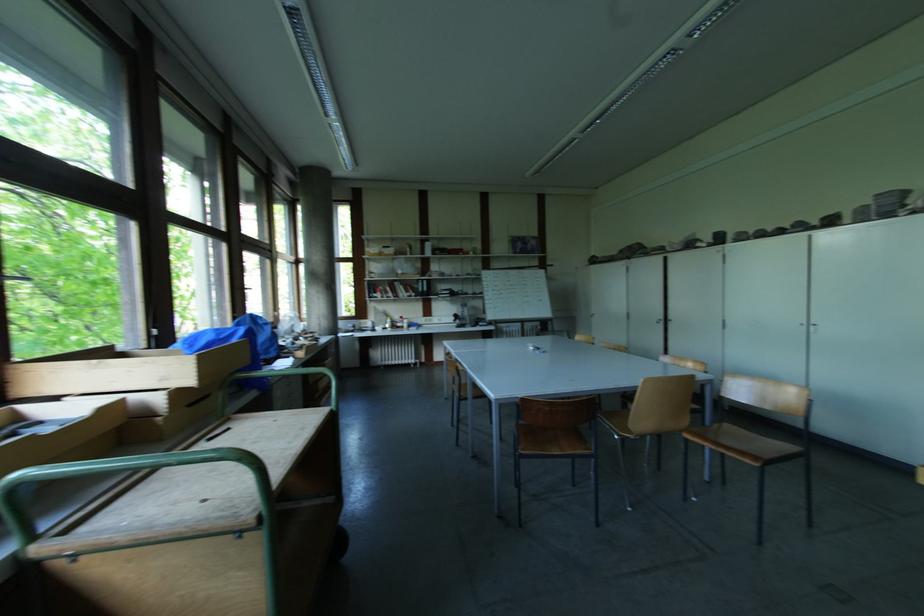
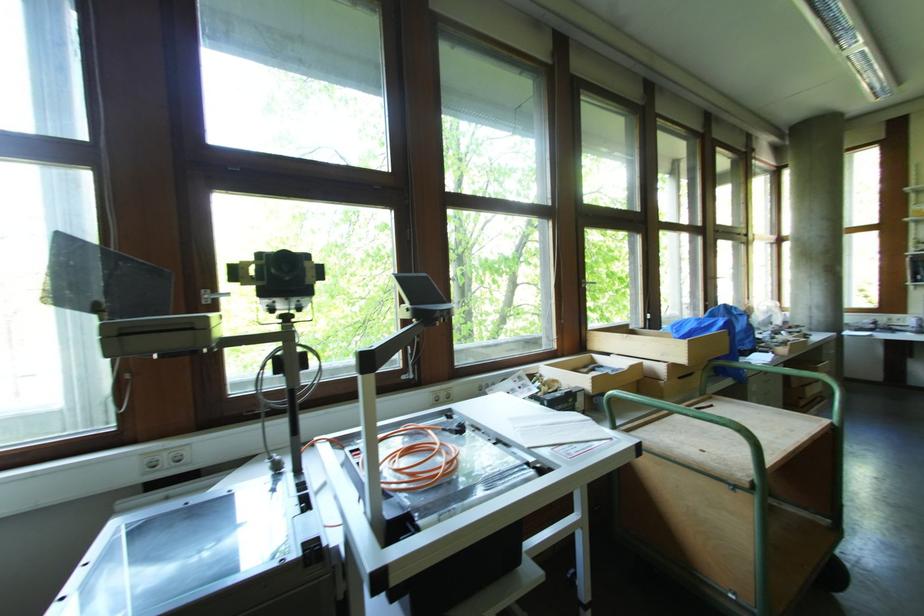
Where in the second image is the point corresponding to the point at 334,411 from the first image?

(834, 426)